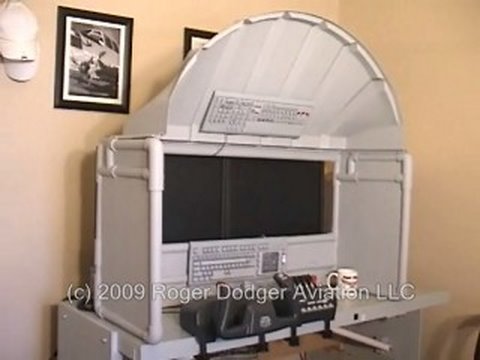
The width and height of the screenshot is (480, 360). I want to click on two white caps hanging on wall, so click(x=6, y=36), click(x=20, y=78).